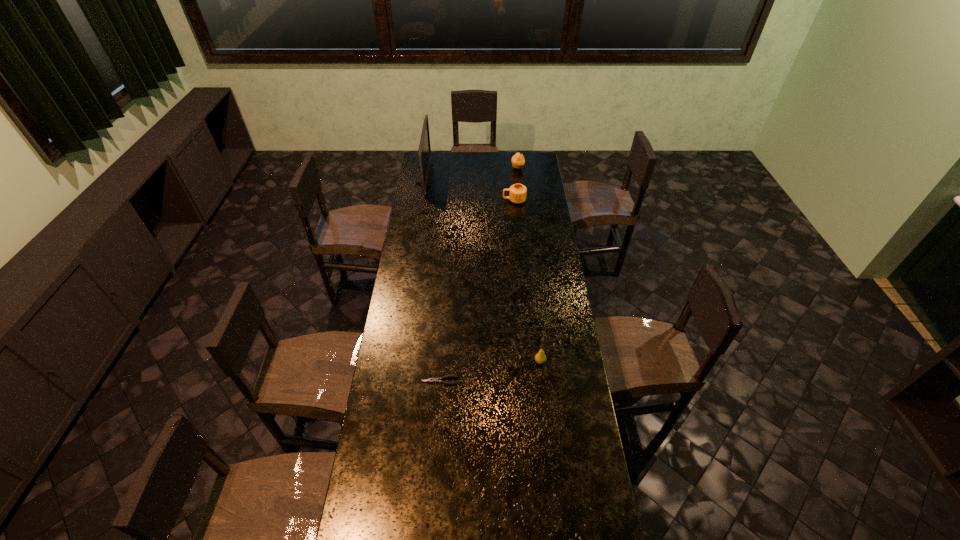
This screenshot has height=540, width=960. Identify the location of monitor. (424, 173).

This screenshot has height=540, width=960. In order to click on the leftmost object in this screenshot , I will do `click(424, 173)`.

At what (x,y) coordinates should I click in order to perform the action: click on the farther pear. Please return your answer as a coordinate pair (x, y). Looking at the image, I should click on (518, 161).

At what (x,y) coordinates should I click in order to perform the action: click on mug. Please return your answer as a coordinate pair (x, y). Looking at the image, I should click on [x=517, y=193].

Find the location of a particular element. The width and height of the screenshot is (960, 540). the shorter pear is located at coordinates [540, 357].

Where is `the fourth farthest object`? Image resolution: width=960 pixels, height=540 pixels. the fourth farthest object is located at coordinates (540, 357).

I want to click on the shortest object, so click(x=436, y=380).

The height and width of the screenshot is (540, 960). Identify the location of the second object from left to right. (436, 380).

I want to click on vacant space located on the screen side of the tallest object, so click(458, 177).

Identify the location of vacant space located on the left of the farther pear. The height and width of the screenshot is (540, 960). (471, 168).